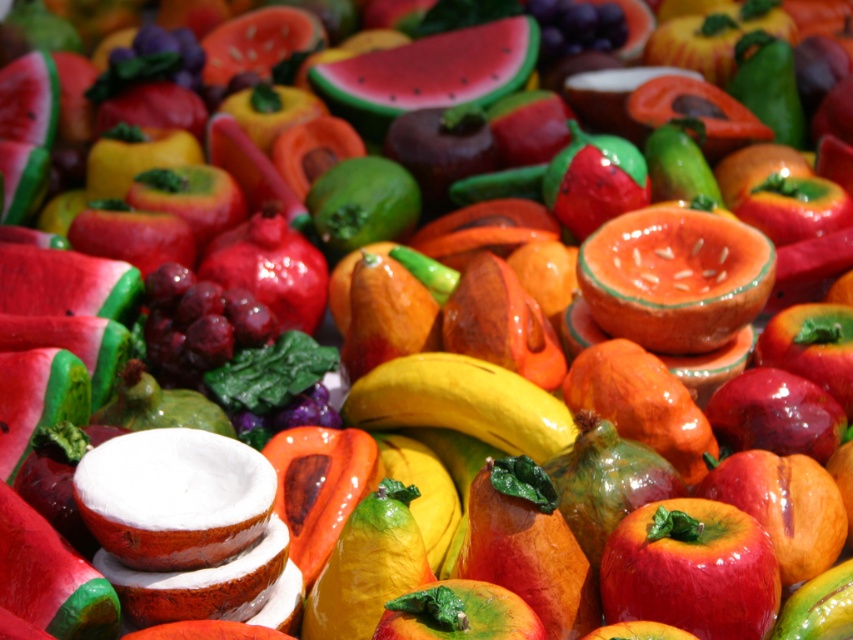
Question: Among these objects, which one is nearest to the camera?

Choices:
 (A) smooth red watermelon at center
 (B) shiny red apple at center

Answer: (B)

Question: Which object is closer to the camera taking this photo?

Choices:
 (A) shiny red apple at center
 (B) smooth red watermelon at center

Answer: (A)

Question: Which of the following is the closest to the observer?

Choices:
 (A) (677, 595)
 (B) (357, 120)

Answer: (A)

Question: Does shiny red apple at center appear over smooth red watermelon at center?

Choices:
 (A) no
 (B) yes

Answer: (A)

Question: Is shiny red apple at center to the left of smooth red watermelon at center from the viewer's perspective?

Choices:
 (A) no
 (B) yes

Answer: (A)

Question: Does shiny red apple at center have a smaller size compared to smooth red watermelon at center?

Choices:
 (A) yes
 (B) no

Answer: (A)